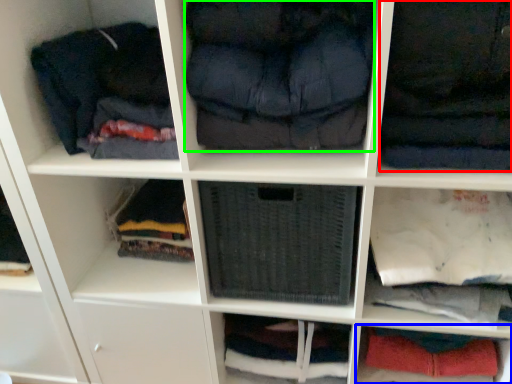
Question: Which is farther away from clothing (highlighted by a red box)? cabinet (highlighted by a blue box) or clothing (highlighted by a green box)?

Choices:
 (A) cabinet
 (B) clothing

Answer: (A)